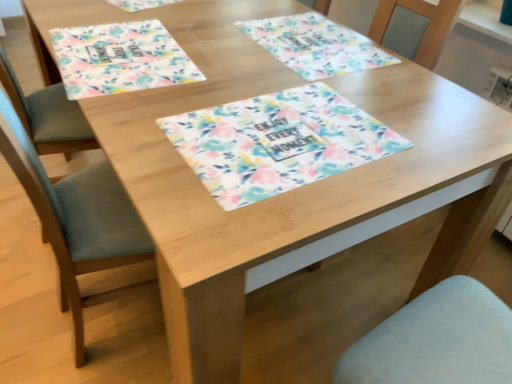
Identify the location of free point below floral fabric placemat at center (from a real-world perspective). Image resolution: width=512 pixels, height=384 pixels. (291, 134).